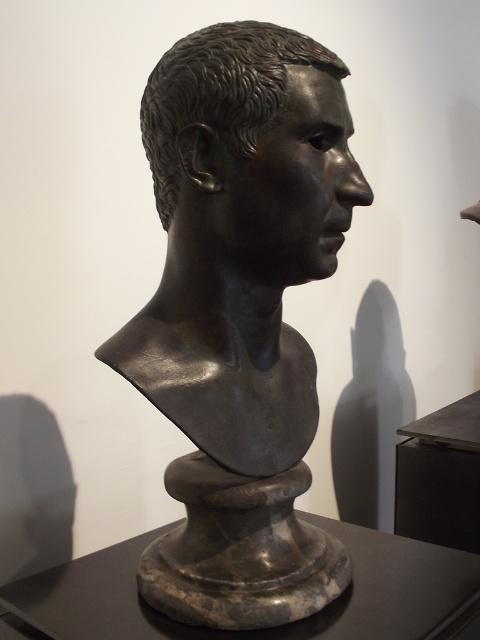
Question: Observing the image, what is the correct spatial positioning of bronze bust at center in reference to bronze head at center?

Choices:
 (A) right
 (B) left

Answer: (B)

Question: Can you confirm if bronze bust at center is positioned above bronze head at center?

Choices:
 (A) yes
 (B) no

Answer: (B)

Question: Among these objects, which one is nearest to the camera?

Choices:
 (A) bronze bust at center
 (B) bronze head at center

Answer: (B)

Question: Does bronze bust at center have a lesser width compared to bronze head at center?

Choices:
 (A) no
 (B) yes

Answer: (A)

Question: Which point is farther to the camera?

Choices:
 (A) bronze bust at center
 (B) bronze head at center

Answer: (A)